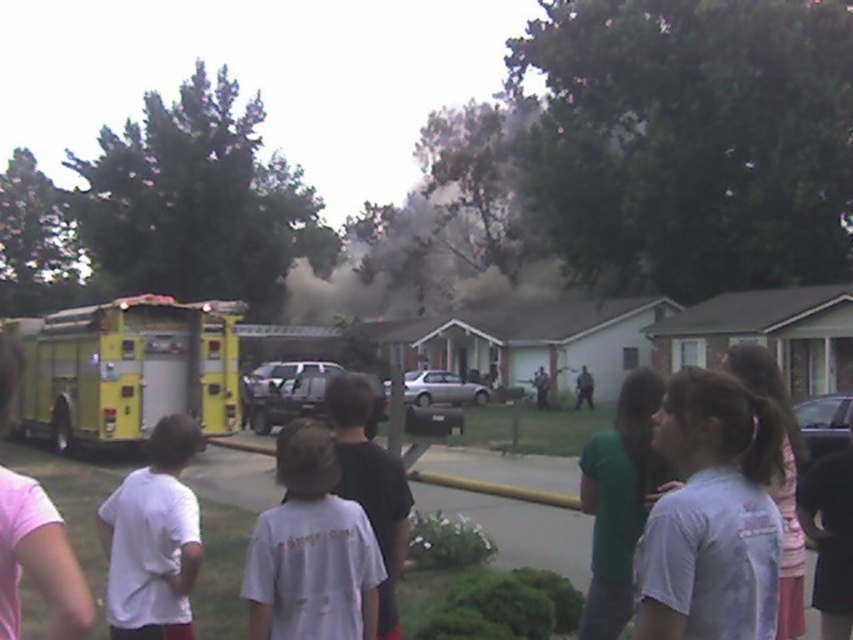
Question: Which point is closer to the camera?

Choices:
 (A) (486, 259)
 (B) (337, 632)
 (C) (120, 324)

Answer: (B)

Question: Which point is farther to the camera?

Choices:
 (A) black dust cloud at center
 (B) yellow metallic fire truck at left

Answer: (A)

Question: Does yellow metallic fire truck at left have a greater width compared to white cotton shirt at center?

Choices:
 (A) no
 (B) yes

Answer: (B)

Question: Is black dust cloud at center below white cotton shirt at center?

Choices:
 (A) yes
 (B) no

Answer: (B)

Question: Which of the following is the closest to the observer?

Choices:
 (A) [56, 410]
 (B) [485, 145]
 (C) [285, 534]

Answer: (C)

Question: Is black dust cloud at center to the right of white cotton shirt at center from the viewer's perspective?

Choices:
 (A) no
 (B) yes

Answer: (A)